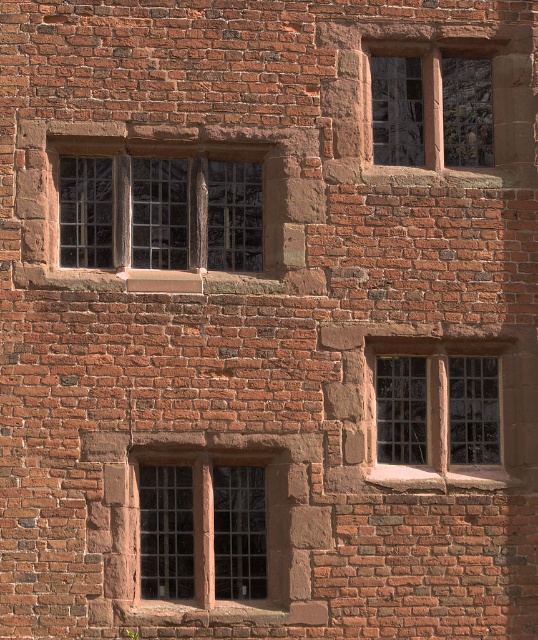
You are an architect examining the brick wall. You need to determine which window allows more natural light into the room. Based on the materials and size of the clear glass window at center and the matte stone window at upper right, which one lets in more light?

The clear glass window at center allows more natural light into the room because it has a larger size and clear glass, which is more transparent than the matte stone material of the matte stone window at upper right.

From the picture: You are an architect inspecting the brick wall and notice the clear glass window at center and the stone textured window at lower right. Which window is located higher up on the wall?

The stone textured window at lower right is positioned above the clear glass window at center, so it is located higher up on the wall.